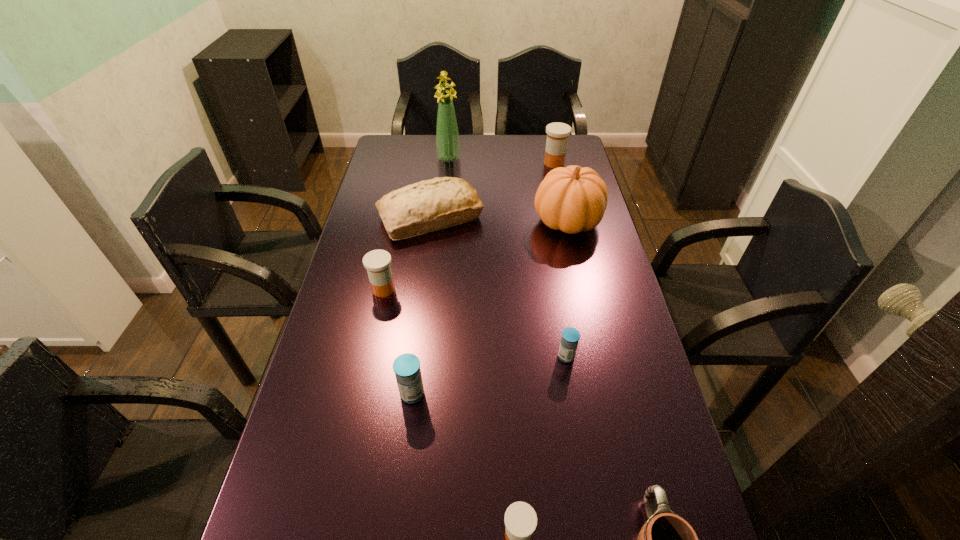
Locate an element on the screen. This screenshot has width=960, height=540. vacant point located on the back of the bigger blue medicine is located at coordinates (420, 336).

At what (x,y) coordinates should I click in order to perform the action: click on free space located 0.080m on the left of the smaller blue medicine. Please return your answer as a coordinate pair (x, y). The width and height of the screenshot is (960, 540). Looking at the image, I should click on (525, 356).

At what (x,y) coordinates should I click in order to perform the action: click on bouquet that is at the far edge. Please return your answer as a coordinate pair (x, y). Image resolution: width=960 pixels, height=540 pixels. Looking at the image, I should click on (447, 135).

Locate an element on the screen. The height and width of the screenshot is (540, 960). medicine at the far edge is located at coordinates (557, 133).

Find the location of a particular element. Image resolution: width=960 pixels, height=540 pixels. bread present at the left edge is located at coordinates (429, 205).

I want to click on medicine that is at the left edge, so click(x=377, y=262).

Locate an element on the screen. This screenshot has width=960, height=540. pumpkin positioned at the right edge is located at coordinates (572, 199).

Find the location of a particular element. The image size is (960, 540). medicine that is at the right edge is located at coordinates (557, 133).

You are a GUI agent. You are given a task and a screenshot of the screen. Output one action in this format:
    pyautogui.click(x=<x>, y=<y>)
    Task: Click on the object present at the far right corner
    This screenshot has width=960, height=540.
    Given the screenshot: What is the action you would take?
    pyautogui.click(x=557, y=133)

In the image, there is a desktop. Where is `vacant space at the far edge`? The image size is (960, 540). vacant space at the far edge is located at coordinates (508, 161).